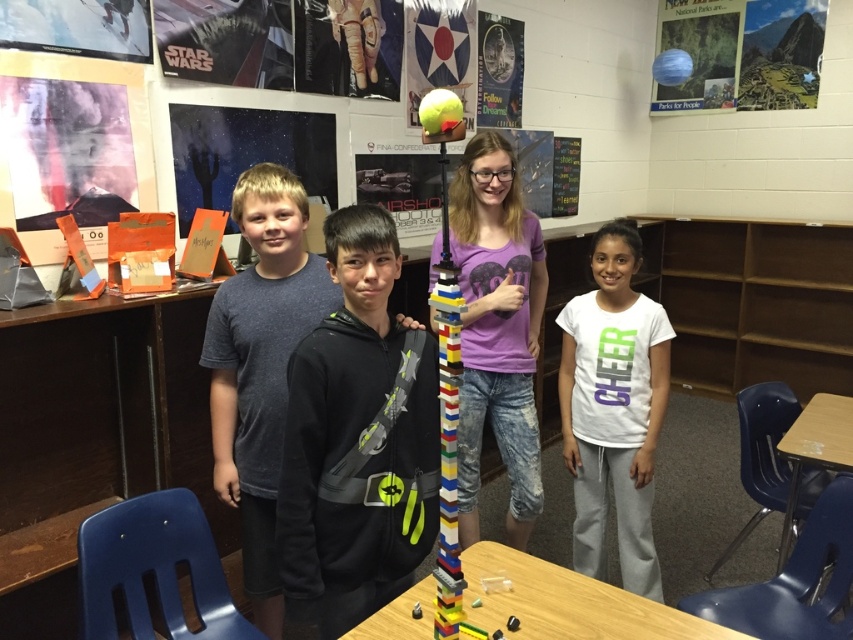
You are a photographer standing in front of the classroom scene. You need to capture a photo where the white cotton shirt at center and the wooden table at center are both visible. Based on their heights, which object will appear taller in the photo?

The white cotton shirt at center will appear taller in the photo since it has a greater height compared to the wooden table at center.

You are a photographer setting up for a group photo in the classroom. You need to ensure that the purple matte shirt at center and the wooden table at lower right are both visible in the frame. Since the photographer is standing at the front of the classroom, which object will appear taller in the photo?

The purple matte shirt at center will appear taller in the photo because it has a greater height compared to the wooden table at lower right.